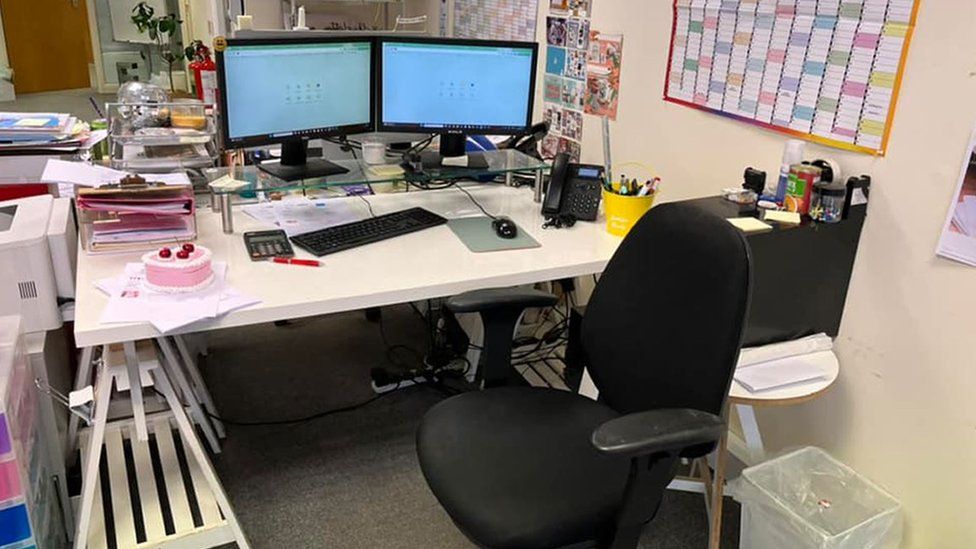
Where is `keyboard`? This screenshot has width=976, height=549. keyboard is located at coordinates (398, 222).